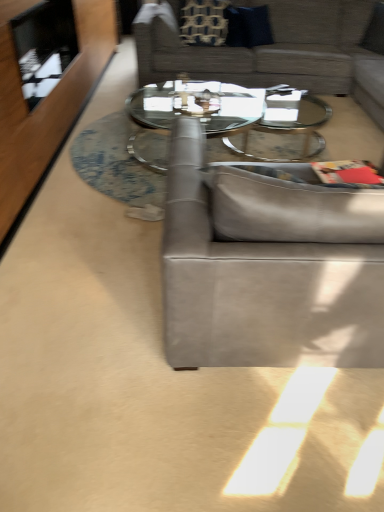
Question: Is patterned fabric pillow at upper center, marked as the second pillow in a right-to-left arrangement, thinner than clear glass coffee table at center?

Choices:
 (A) yes
 (B) no

Answer: (A)

Question: Is patterned fabric pillow at upper center, marked as the second pillow in a right-to-left arrangement, looking in the opposite direction of clear glass coffee table at center?

Choices:
 (A) no
 (B) yes

Answer: (A)

Question: Can you confirm if patterned fabric pillow at upper center, marked as the second pillow in a right-to-left arrangement, is taller than clear glass coffee table at center?

Choices:
 (A) no
 (B) yes

Answer: (B)

Question: Could clear glass coffee table at center be considered to be inside patterned fabric pillow at upper center, marked as the second pillow in a right-to-left arrangement?

Choices:
 (A) yes
 (B) no

Answer: (B)

Question: Can you confirm if patterned fabric pillow at upper center, arranged as the first pillow when viewed from the left, is shorter than clear glass coffee table at center?

Choices:
 (A) yes
 (B) no

Answer: (B)

Question: Is dark blue fabric pillow at upper center, the second pillow from the left, situated inside patterned fabric pillow at upper center, arranged as the first pillow when viewed from the left, or outside?

Choices:
 (A) outside
 (B) inside

Answer: (A)

Question: From a real-world perspective, relative to patterned fabric pillow at upper center, marked as the second pillow in a right-to-left arrangement, is dark blue fabric pillow at upper center, placed as the first pillow when sorted from right to left, vertically above or below?

Choices:
 (A) above
 (B) below

Answer: (B)

Question: Considering the relative positions of dark blue fabric pillow at upper center, placed as the first pillow when sorted from right to left, and patterned fabric pillow at upper center, marked as the second pillow in a right-to-left arrangement, in the image provided, is dark blue fabric pillow at upper center, placed as the first pillow when sorted from right to left, to the left or to the right of patterned fabric pillow at upper center, marked as the second pillow in a right-to-left arrangement,?

Choices:
 (A) left
 (B) right

Answer: (B)

Question: Considering the positions of dark blue fabric pillow at upper center, the second pillow from the left, and patterned fabric pillow at upper center, marked as the second pillow in a right-to-left arrangement, in the image, is dark blue fabric pillow at upper center, the second pillow from the left, wider or thinner than patterned fabric pillow at upper center, marked as the second pillow in a right-to-left arrangement,?

Choices:
 (A) thin
 (B) wide

Answer: (B)

Question: Is suede gray couch at center, the 2th studio couch positioned from the top, spatially inside textured gray couch at upper center, the second studio couch ordered from the bottom, or outside of it?

Choices:
 (A) inside
 (B) outside

Answer: (B)

Question: Is suede gray couch at center, placed as the 1th studio couch when sorted from bottom to top, taller or shorter than textured gray couch at upper center, acting as the first studio couch starting from the back?

Choices:
 (A) short
 (B) tall

Answer: (B)

Question: From a real-world perspective, is suede gray couch at center, placed as the 1th studio couch when sorted from bottom to top, above or below textured gray couch at upper center, which is the second studio couch in front-to-back order?

Choices:
 (A) below
 (B) above

Answer: (A)

Question: Visually, is suede gray couch at center, placed as the 1th studio couch when sorted from bottom to top, positioned to the left or to the right of textured gray couch at upper center, marked as the first studio couch in a top-to-bottom arrangement?

Choices:
 (A) left
 (B) right

Answer: (A)

Question: Is suede gray couch at center, placed as the 1th studio couch when sorted from bottom to top, in front of or behind clear glass coffee table at center in the image?

Choices:
 (A) front
 (B) behind

Answer: (A)

Question: From the image's perspective, relative to clear glass coffee table at center, is suede gray couch at center, placed as the 1th studio couch when sorted from bottom to top, above or below?

Choices:
 (A) above
 (B) below

Answer: (B)